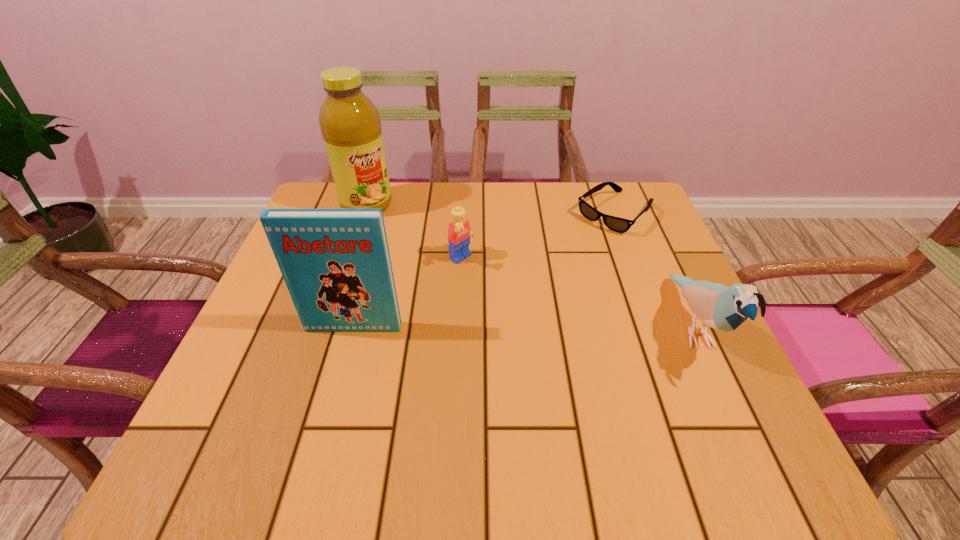
Locate an element on the screen. vacant area located on the front label of the tallest object is located at coordinates (462, 308).

The height and width of the screenshot is (540, 960). I want to click on vacant space positioned 0.310m on the front-facing side of the sunglasses, so click(517, 295).

Locate an element on the screen. The image size is (960, 540). free region located on the front-facing side of the sunglasses is located at coordinates (558, 262).

Find the location of a particular element. Image resolution: width=960 pixels, height=540 pixels. vacant space located on the front-facing side of the sunglasses is located at coordinates (515, 298).

This screenshot has height=540, width=960. I want to click on vacant position located on the face of the third object from left to right, so click(496, 285).

At what (x,y) coordinates should I click in order to perform the action: click on vacant area located 0.150m on the face of the third object from left to right. Please return your answer as a coordinate pair (x, y). Looking at the image, I should click on (519, 301).

Locate an element on the screen. The image size is (960, 540). vacant space located 0.340m on the face of the third object from left to right is located at coordinates (594, 353).

The height and width of the screenshot is (540, 960). Identify the location of fruit juice that is at the far edge. (350, 124).

Where is `sunglasses present at the far edge`? The width and height of the screenshot is (960, 540). sunglasses present at the far edge is located at coordinates (617, 224).

Identify the location of object located in the near edge section of the desktop. The height and width of the screenshot is (540, 960). coord(720,307).